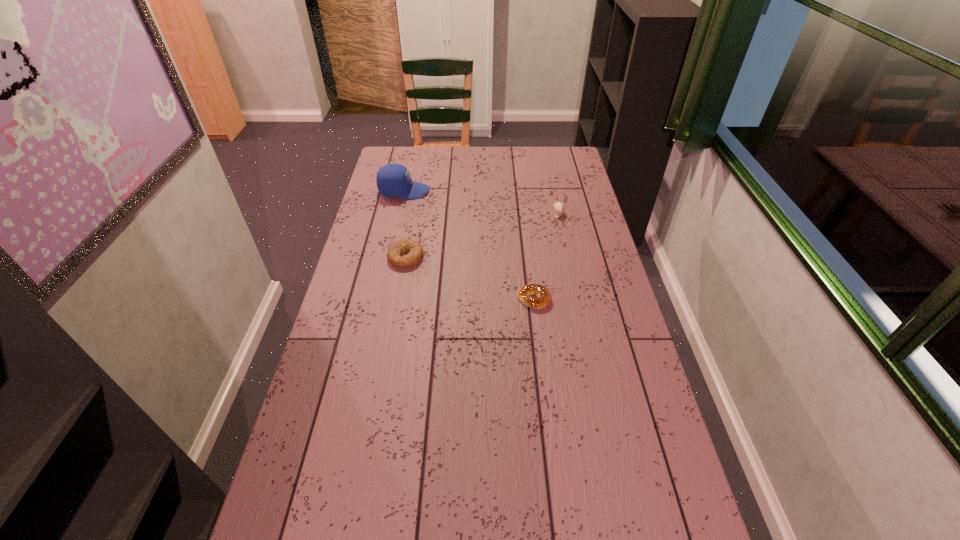
Where is `object identified as the second closest to the rightmost object`? This screenshot has height=540, width=960. object identified as the second closest to the rightmost object is located at coordinates (393, 180).

Find the location of a particular element. vacant space that satisfies the following two spatial constraints: 1. on the front-facing side of the farthest object; 2. on the left side of the left bagel is located at coordinates (389, 257).

This screenshot has height=540, width=960. In order to click on free space in the image that satisfies the following two spatial constraints: 1. on the back side of the third object from left to right; 2. on the front-facing side of the tallest object in this screenshot , I will do `click(521, 191)`.

Where is `free space in the image that satisfies the following two spatial constraints: 1. on the front-facing side of the farthest object; 2. on the right side of the farther bagel`? The width and height of the screenshot is (960, 540). free space in the image that satisfies the following two spatial constraints: 1. on the front-facing side of the farthest object; 2. on the right side of the farther bagel is located at coordinates (389, 257).